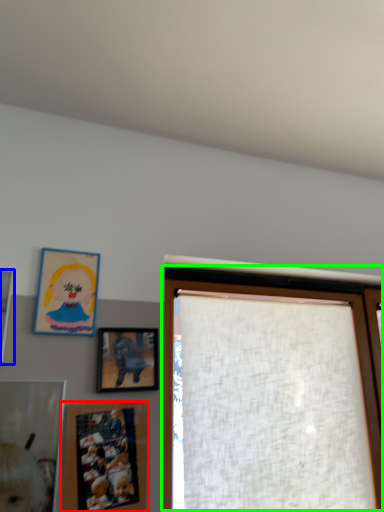
Question: Based on their relative distances, which object is nearer to picture frame (highlighted by a red box)? Choose from picture frame (highlighted by a blue box) and window (highlighted by a green box).

Choices:
 (A) picture frame
 (B) window

Answer: (B)